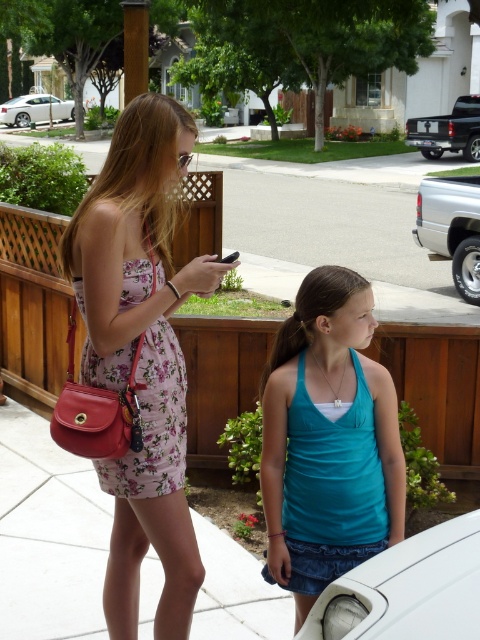
Question: Estimate the real-world distances between objects in this image. Which object is farther from the silver metallic truck at right?

Choices:
 (A) white matte car at lower right
 (B) white concrete pavement at center
 (C) teal fabric tank top at center

Answer: (A)

Question: Can you confirm if white matte car at lower right is wider than black plastic smartphone at center?

Choices:
 (A) no
 (B) yes

Answer: (B)

Question: Is teal fabric tank top at center below white concrete pavement at center?

Choices:
 (A) yes
 (B) no

Answer: (A)

Question: Based on their relative distances, which object is nearer to the white matte car at lower right?

Choices:
 (A) black matte truck at right
 (B) white glossy sedan at upper left
 (C) teal fabric tank top at center

Answer: (C)

Question: Where is white matte car at lower right located in relation to white glossy sedan at upper left in the image?

Choices:
 (A) below
 (B) above

Answer: (A)

Question: Estimate the real-world distances between objects in this image. Which object is farther from the black plastic smartphone at center?

Choices:
 (A) silver metallic truck at right
 (B) white glossy sedan at upper left
 (C) white concrete pavement at center
 (D) white matte car at lower right

Answer: (B)